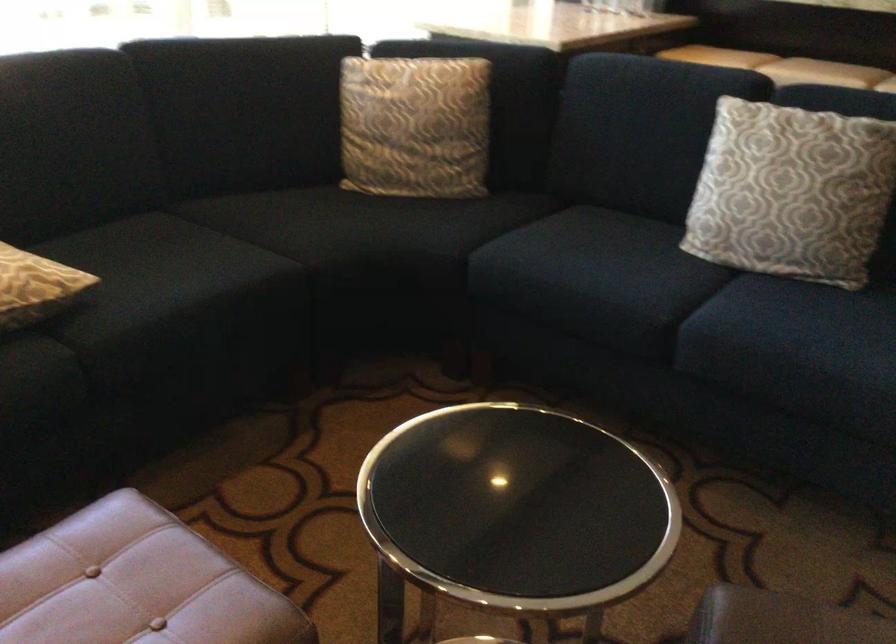
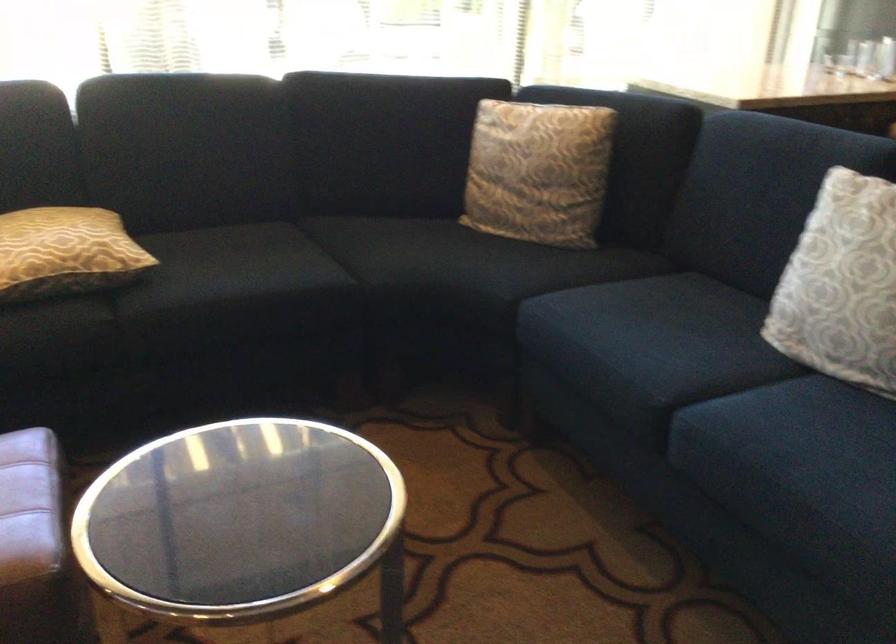
Locate, in the second image, the point that corresponds to point 424,126 in the first image.

(538, 172)